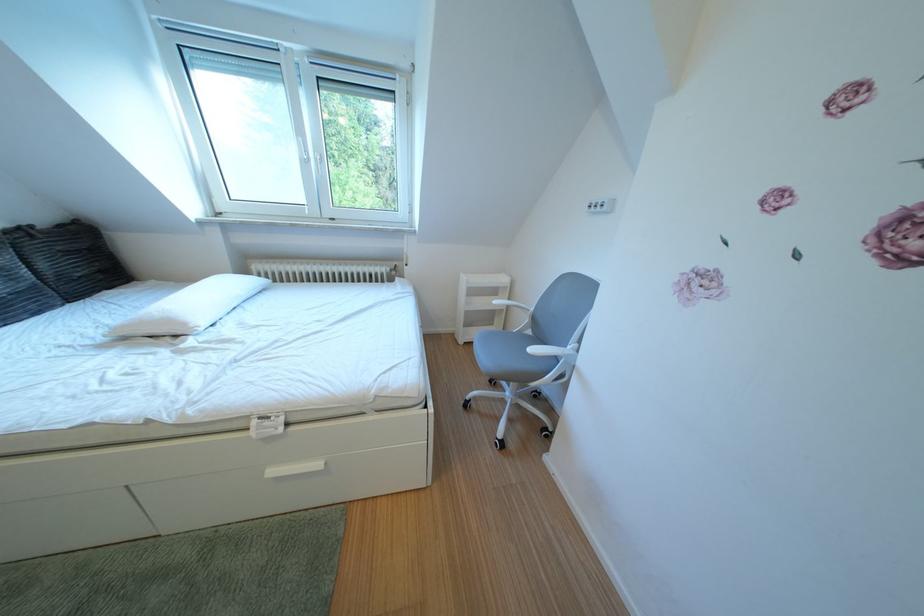
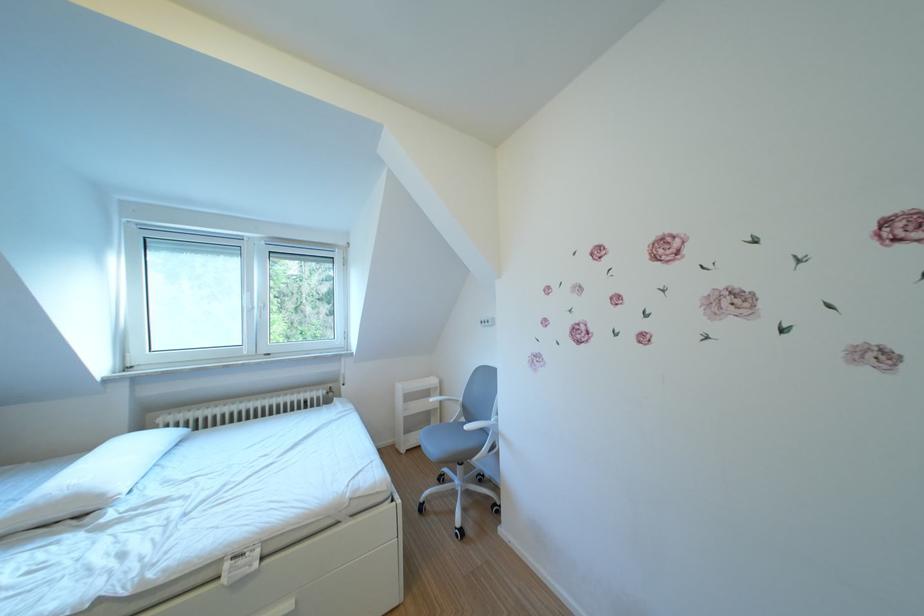
Where in the second image is the point corresponding to the point at 199,330 from the first image?

(115, 501)